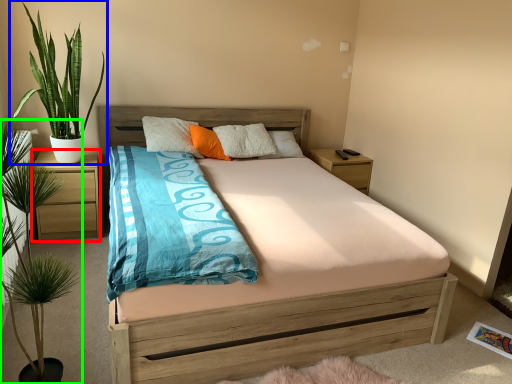
Question: Which is nearer to the nightstand (highlighted by a red box)? houseplant (highlighted by a blue box) or houseplant (highlighted by a green box).

Choices:
 (A) houseplant
 (B) houseplant

Answer: (A)